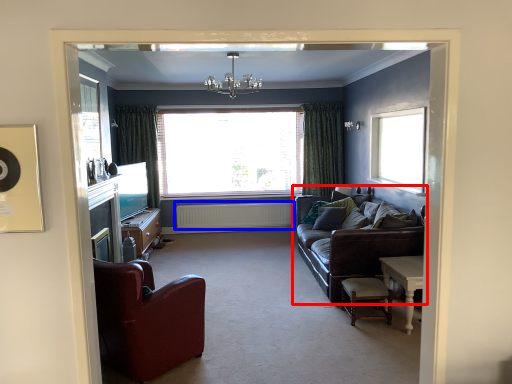
Question: Among these objects, which one is nearest to the camera, studio couch (highlighted by a red box) or radiator (highlighted by a blue box)?

Choices:
 (A) studio couch
 (B) radiator

Answer: (A)